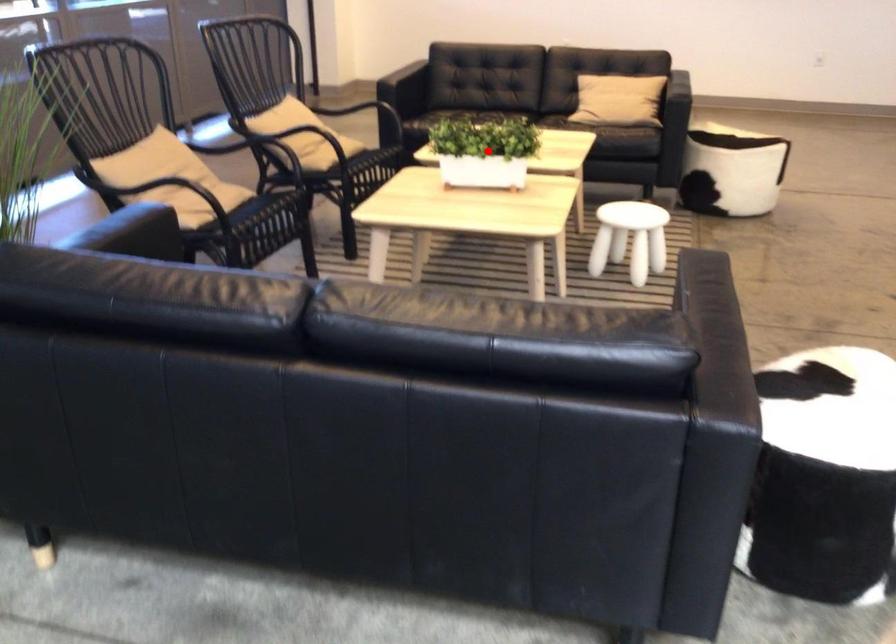
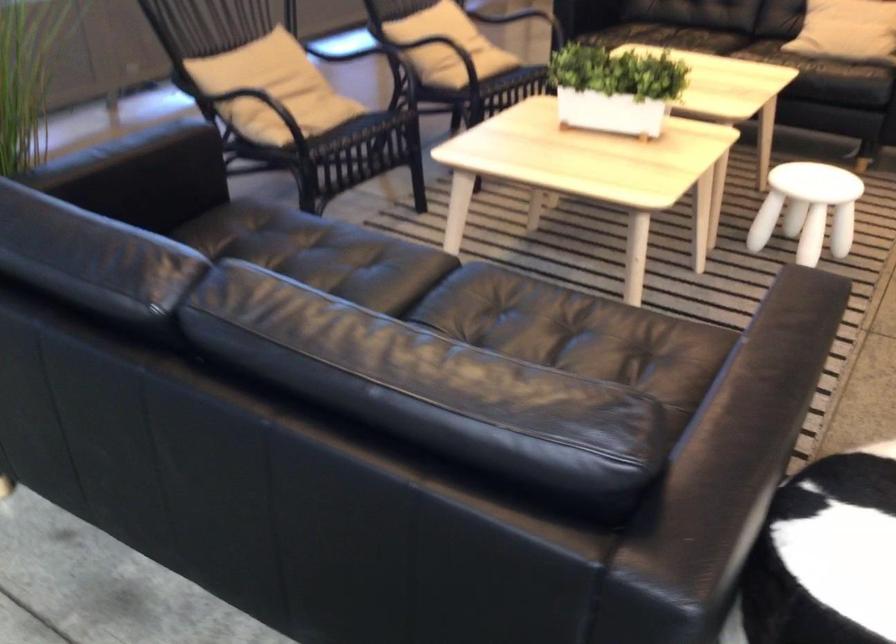
Question: A red point is marked in image1. In image2, is the corresponding 3D point closer to the camera or farther? Reply with the corresponding letter.

Choices:
 (A) The corresponding 3D point is closer.
 (B) The corresponding 3D point is farther.

Answer: (A)